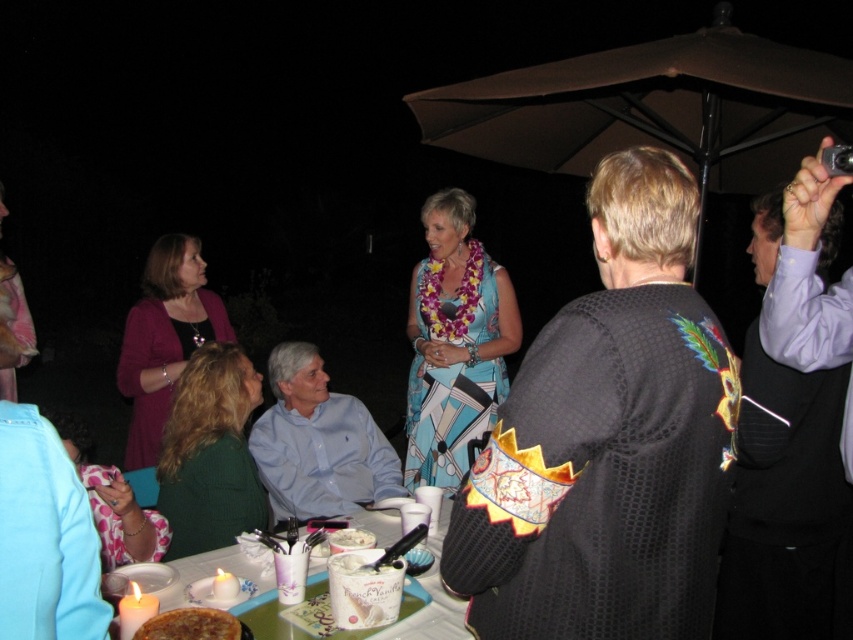
You are at a party and want to place a large birthday cake on the table. The cake is the same size as the green knitted sweater at lower left. Will it fit on the white glossy table at center?

The green knitted sweater at lower left is larger in size than the white glossy table at center, so the cake may not fit on the white glossy table at center since it is smaller than the cake.

Consider the image. You are a photographer at the event and need to capture both the pink fabric dress at left and the golden brown crusty pie at lower left in a single frame. Since the camera can only focus on one object at a time, which object should you focus on to ensure it appears clearer in the photo?

The pink fabric dress at left is larger in size than the golden brown crusty pie at lower left, so focusing on the pink fabric dress at left would make it appear clearer in the photo since it takes up more space in the frame.